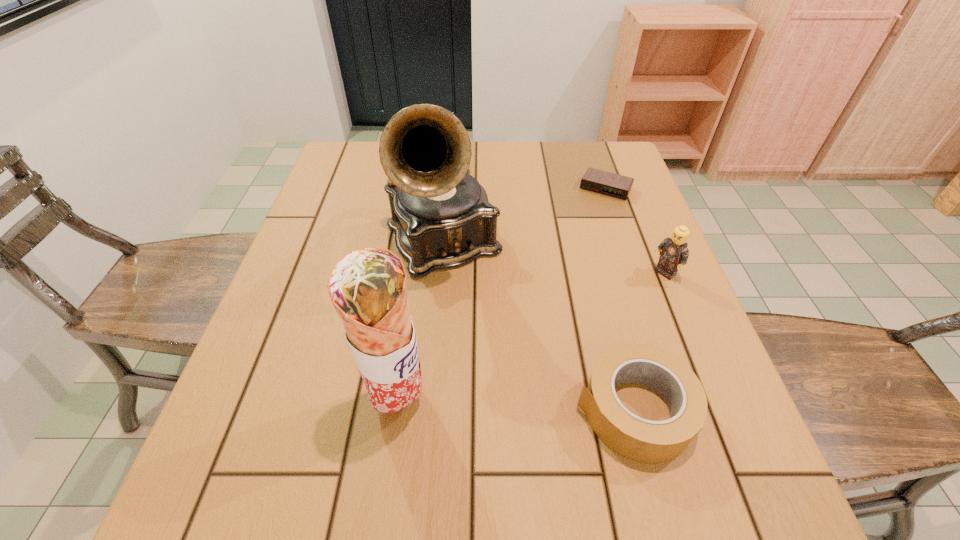
Where is `vacant spot on the desktop that is between the second tallest object and the fourth tallest object and is positioned on the front face of the alarm clock`? vacant spot on the desktop that is between the second tallest object and the fourth tallest object and is positioned on the front face of the alarm clock is located at coordinates (494, 405).

Where is `free space on the desktop that is between the second tallest object and the duct tape and is positioned in front of the third tallest object`? free space on the desktop that is between the second tallest object and the duct tape and is positioned in front of the third tallest object is located at coordinates (493, 405).

What are the coordinates of `free space on the desktop that is between the fourth shortest object and the fourth tallest object and is positioned on the horn of the phonograph record` in the screenshot? It's located at (535, 407).